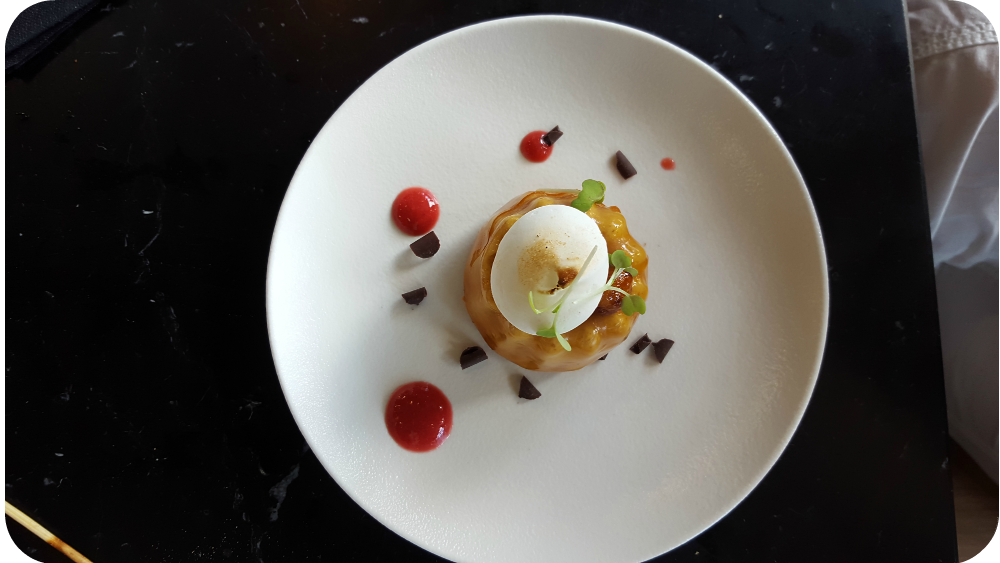
The image size is (1000, 563). I want to click on black tray, so click(x=825, y=468).